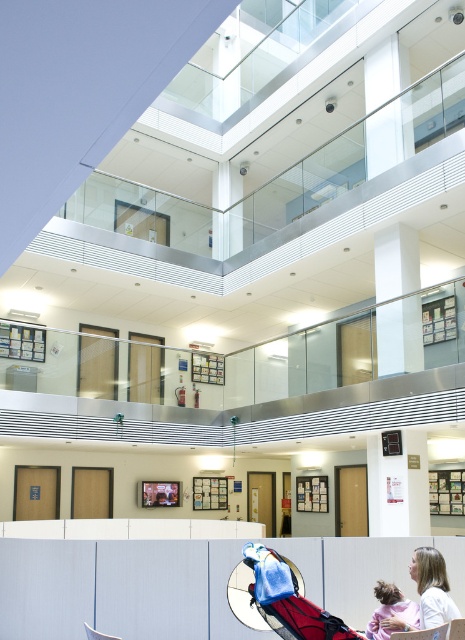
Question: Is red fabric baby carriage at lower center bigger than light brown hair at lower right?

Choices:
 (A) no
 (B) yes

Answer: (B)

Question: Is red fabric baby carriage at lower center to the right of pink fabric child at lower right from the viewer's perspective?

Choices:
 (A) yes
 (B) no

Answer: (B)

Question: Which point is farther to the camera?

Choices:
 (A) light brown hair at lower right
 (B) red fabric baby carriage at lower center
 (C) pink fabric child at lower right

Answer: (C)

Question: Which point appears closest to the camera in this image?

Choices:
 (A) (243, 595)
 (B) (378, 625)

Answer: (B)

Question: Based on their relative distances, which object is nearer to the pink fabric child at lower right?

Choices:
 (A) light brown hair at lower right
 (B) red fabric baby carriage at lower center

Answer: (A)

Question: From the image, what is the correct spatial relationship of red fabric baby carriage at lower center in relation to light brown hair at lower right?

Choices:
 (A) left
 (B) right

Answer: (A)